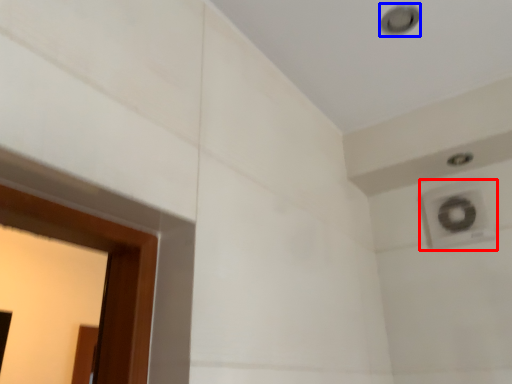
Question: Which of the following is the closest to the observer, air conditioning (highlighted by a red box) or hole (highlighted by a blue box)?

Choices:
 (A) air conditioning
 (B) hole

Answer: (B)